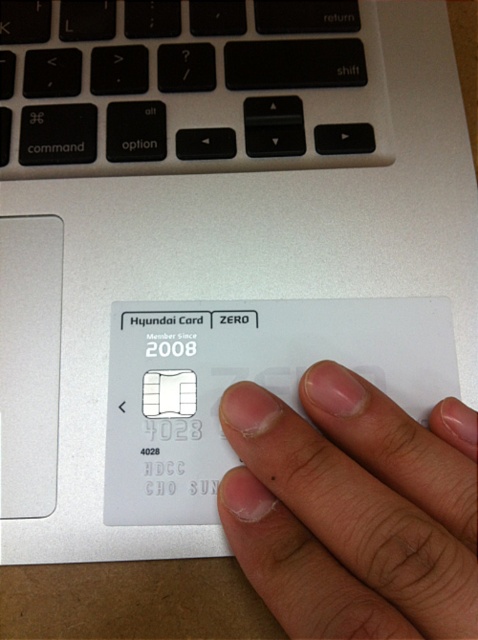
Is black plastic keyboard at upper center further to camera compared to nail polish matte finger at center?

Yes, black plastic keyboard at upper center is further from the viewer.

Is the position of black plastic keyboard at upper center less distant than that of nail polish matte finger at center?

No, black plastic keyboard at upper center is further to the viewer.

This screenshot has width=478, height=640. I want to click on black plastic keyboard at upper center, so click(186, 86).

Locate an element on the screen. The width and height of the screenshot is (478, 640). black plastic keyboard at upper center is located at coordinates (186, 86).

Does nail polish matte finger at center appear over white plastic card at center?

Actually, nail polish matte finger at center is below white plastic card at center.

Can you confirm if nail polish matte finger at center is thinner than white plastic card at center?

Indeed, nail polish matte finger at center has a lesser width compared to white plastic card at center.

Who is more distant from viewer, (442, 592) or (171, 477)?

The point (171, 477) is behind.

You are a GUI agent. You are given a task and a screenshot of the screen. Output one action in this format:
    pyautogui.click(x=<x>, y=<y>)
    Task: Click on the nail polish matte finger at center
    This screenshot has height=640, width=478.
    Given the screenshot: What is the action you would take?
    pyautogui.click(x=352, y=509)

Can you confirm if black plastic keyboard at upper center is positioned to the left of white plastic card at center?

Indeed, black plastic keyboard at upper center is positioned on the left side of white plastic card at center.

Who is positioned more to the right, black plastic keyboard at upper center or white plastic card at center?

From the viewer's perspective, white plastic card at center appears more on the right side.

Who is more distant from viewer, (x=207, y=147) or (x=209, y=461)?

The point (x=207, y=147) is behind.

Locate an element on the screen. black plastic keyboard at upper center is located at coordinates (186, 86).